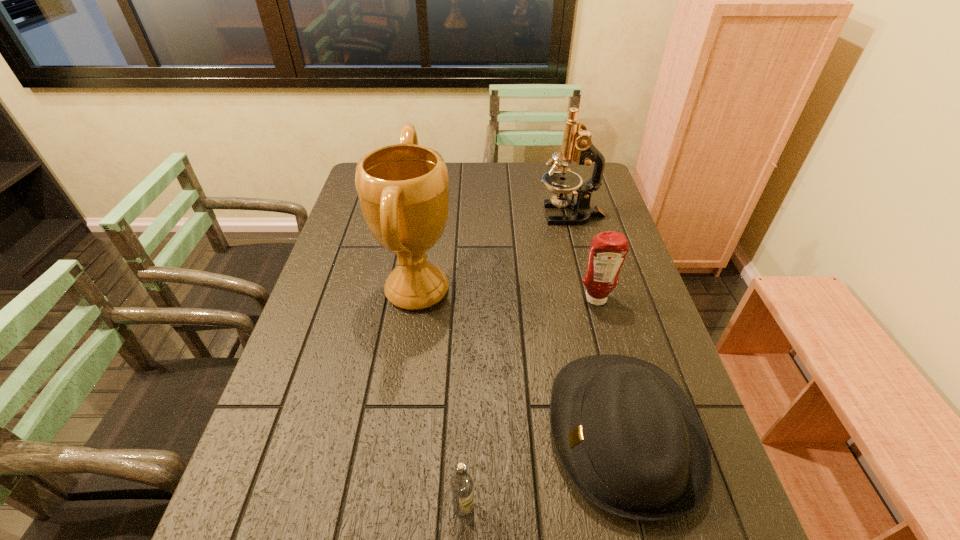
Locate an element on the screen. vacant region located on the front-facing side of the fedora is located at coordinates (396, 433).

At what (x,y) coordinates should I click in order to perform the action: click on vacant space located on the front-facing side of the fedora. Please return your answer as a coordinate pair (x, y). The height and width of the screenshot is (540, 960). Looking at the image, I should click on (x=358, y=433).

The height and width of the screenshot is (540, 960). Identify the location of free spot located 0.210m on the front-facing side of the fedora. (448, 433).

The width and height of the screenshot is (960, 540). Find the location of `microscope that is at the right edge`. microscope that is at the right edge is located at coordinates (577, 146).

This screenshot has width=960, height=540. I want to click on condiment that is at the right edge, so click(x=608, y=250).

The width and height of the screenshot is (960, 540). What are the coordinates of `fedora that is at the right edge` in the screenshot? It's located at (628, 437).

Where is `free space at the left edge`? free space at the left edge is located at coordinates (361, 302).

This screenshot has height=540, width=960. In order to click on vacant space at the right edge of the desktop in this screenshot , I will do `click(659, 355)`.

This screenshot has height=540, width=960. Find the location of `free space at the far right corner of the desktop`. free space at the far right corner of the desktop is located at coordinates (583, 176).

Locate an element on the screen. The image size is (960, 540). free area in between the farthest object and the fedora is located at coordinates (597, 324).